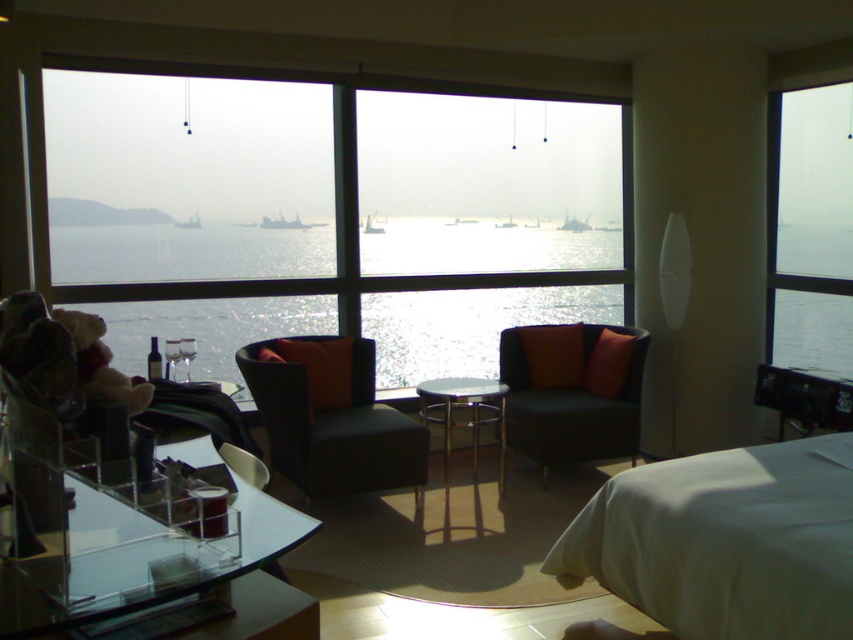
You are standing in the modern hotel room and want to admire the sea view through the transparent glass window at center. Based on the coordinates provided, is the window positioned closer to the left or right side of the room?

The transparent glass window at center is located at coordinates point (334, 214), which places it closer to the left side of the room since the x coordinate is 0.336, indicating it is positioned to the left of the center point.

You are a guest staying in this hotel room and want to enjoy the sea view while sitting on the matte black couch at center. Can you see the sea through the transparent glass window at center from your current position?

The matte black couch at center is behind the transparent glass window at center, so yes, you can see the sea through the transparent glass window at center while sitting on the matte black couch at center.